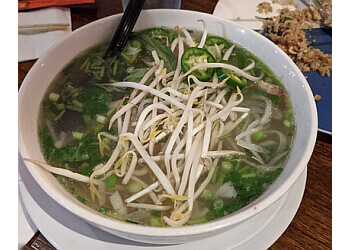
Where is `plate`? The width and height of the screenshot is (350, 250). plate is located at coordinates (247, 234).